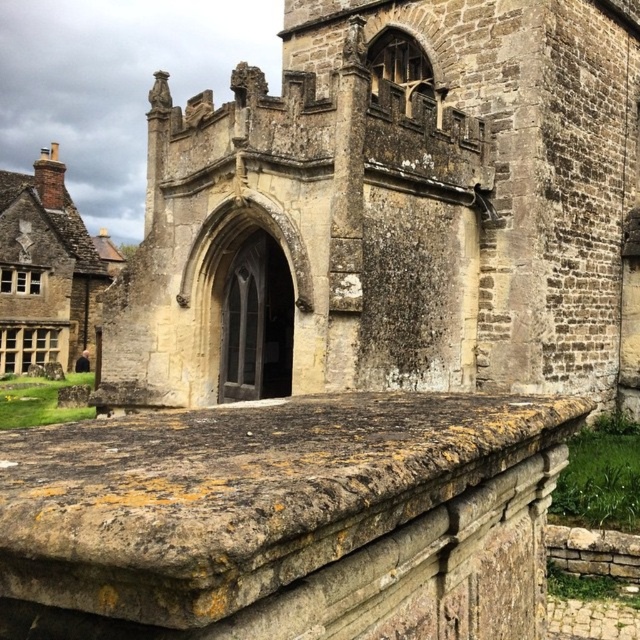
You are standing in front of the historic stone building and want to touch the weathered stone ledge at center. If you extend your hand straight ahead, will your hand reach the point at coordinates (285, 518)?

Yes, the point at coordinates (285, 518) corresponds to the weathered stone ledge at center, so extending your hand straight ahead will reach it.

You are standing in front of the historic stone building. There is a point marked at coordinates (397,209). What is located at that point?

The point at coordinates (397,209) is located at the stone church at center.